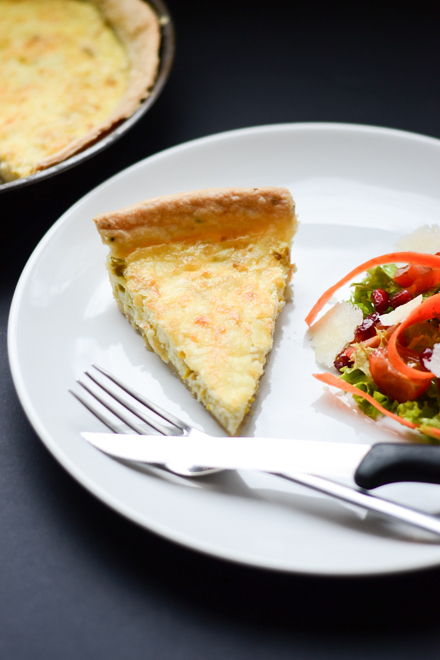
Find the location of `fork`. fork is located at coordinates (166, 429).